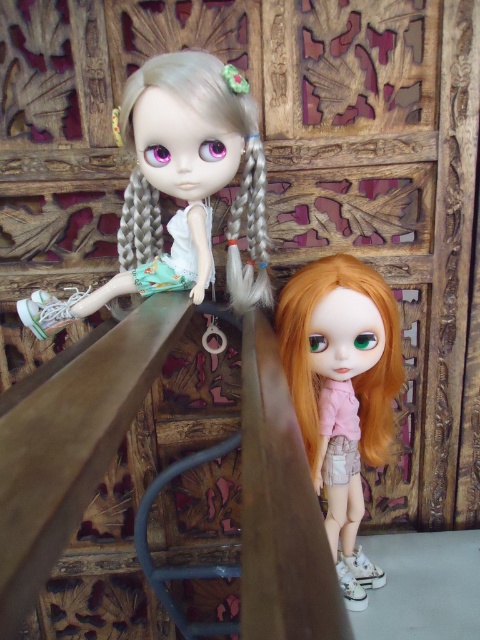
You are a toy organizer who needs to place the matte white doll at upper left and the matte pink shirt at center into a storage box. The box has a width of 9 inches. Can both items fit side by side without overlapping?

The matte white doll at upper left is 8.63 inches from the matte pink shirt at center, so they can fit side by side in the 9 inch wide box since the distance between them is less than the box width.

You are a photographer trying to capture the perfect shot of the two dolls positioned on the staircase. You notice a specific point marked at coordinates (179, 188). Based on the scene description, can you determine which doll this point is associated with?

The point at coordinates (179, 188) is on the matte white doll at upper left.

You are a toy collector trying to arrange these dolls on a shelf. Given that the shelf has a height limit of 30 cm, and the matte pink shirt at center is 28 cm tall, will the matte white doll at upper left also fit on the shelf without exceeding the height limit?

The matte white doll at upper left is not as tall as the matte pink shirt at center, which is 28 cm. Since the shelf has a 30 cm height limit, the matte white doll at upper left will definitely fit without exceeding the limit.